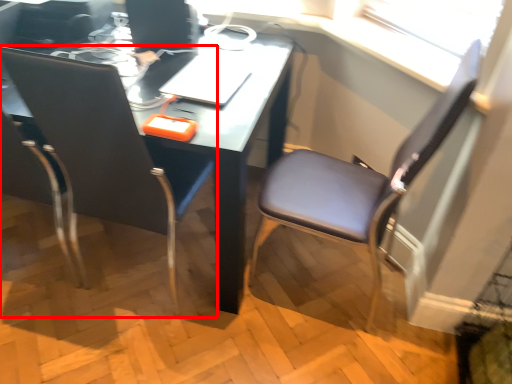
Question: From the image's perspective, what is the correct spatial relationship of chair (annotated by the red box) in relation to chair?

Choices:
 (A) below
 (B) above

Answer: (B)